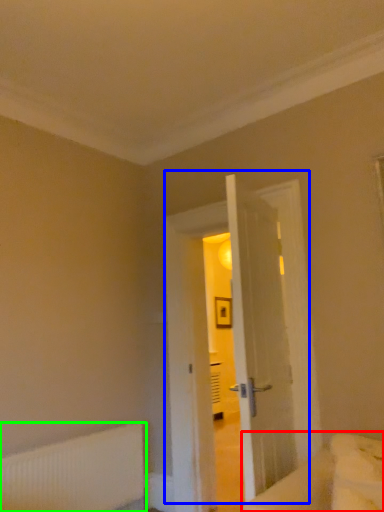
Question: Which is farther away from bed (highlighted by a red box)? door (highlighted by a blue box) or radiator (highlighted by a green box)?

Choices:
 (A) door
 (B) radiator

Answer: (B)